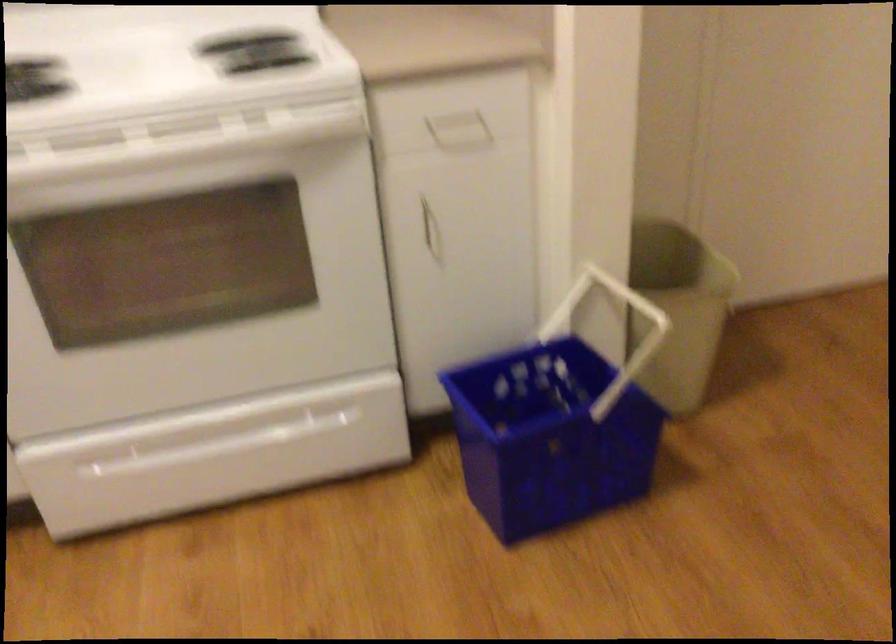
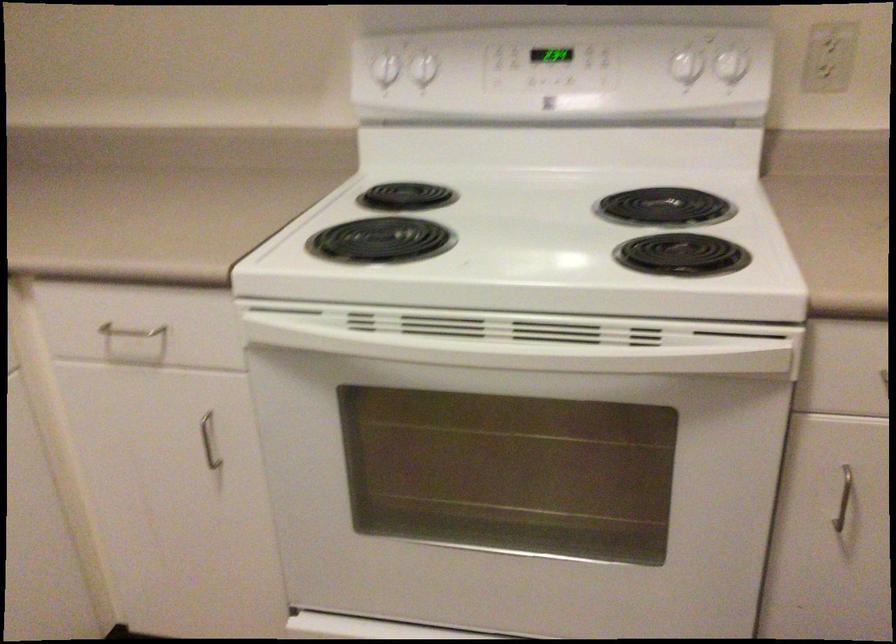
Where in the second image is the point corresponding to the point at 428,220 from the first image?

(842, 498)